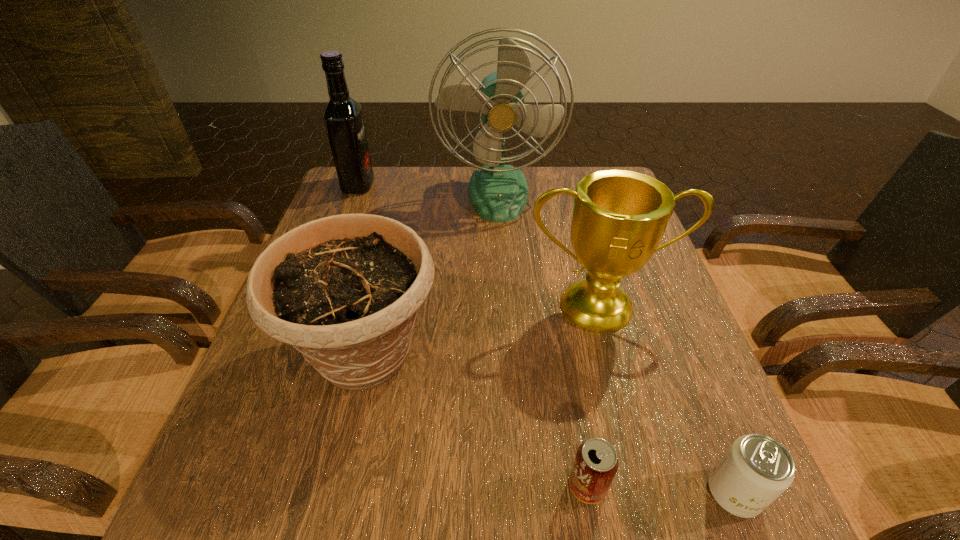
The height and width of the screenshot is (540, 960). I want to click on free space located 0.280m on the left of the right soda can, so click(527, 493).

I want to click on blank area located 0.160m on the back of the left soda can, so click(x=569, y=382).

I want to click on fan located at the far edge, so click(499, 193).

The height and width of the screenshot is (540, 960). I want to click on liquor at the far edge, so click(x=343, y=117).

This screenshot has height=540, width=960. I want to click on liquor that is positioned at the left edge, so click(x=343, y=117).

I want to click on flowerpot that is at the left edge, so (x=344, y=290).

Where is `award located in the right edge section of the desktop`? award located in the right edge section of the desktop is located at coordinates (619, 217).

At what (x,y) coordinates should I click in order to perform the action: click on soda can positioned at the right edge. Please return your answer as a coordinate pair (x, y). This screenshot has width=960, height=540. Looking at the image, I should click on (756, 469).

Where is `object that is at the far left corner`? object that is at the far left corner is located at coordinates (343, 117).

Locate an element on the screen. Image resolution: width=960 pixels, height=540 pixels. object at the near right corner is located at coordinates (756, 469).